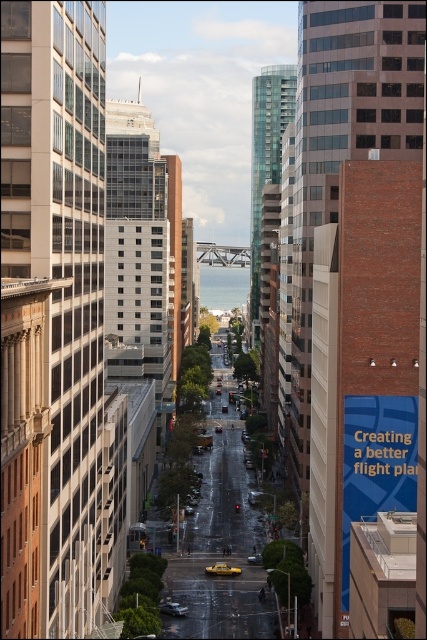
Question: Which object is closer to the camera taking this photo?

Choices:
 (A) metallic silver sedan at center
 (B) yellow rubber taxi at center

Answer: (A)

Question: Which of the following is the closest to the observer?

Choices:
 (A) (207, 568)
 (B) (173, 604)

Answer: (B)

Question: Does yellow rubber taxi at center have a smaller size compared to metallic silver sedan at center?

Choices:
 (A) no
 (B) yes

Answer: (B)

Question: Is yellow rubber taxi at center positioned behind metallic silver sedan at center?

Choices:
 (A) no
 (B) yes

Answer: (B)

Question: Which of the following is the closest to the observer?

Choices:
 (A) metallic silver sedan at center
 (B) yellow rubber taxi at center

Answer: (A)

Question: Is yellow rubber taxi at center smaller than metallic silver sedan at center?

Choices:
 (A) no
 (B) yes

Answer: (B)